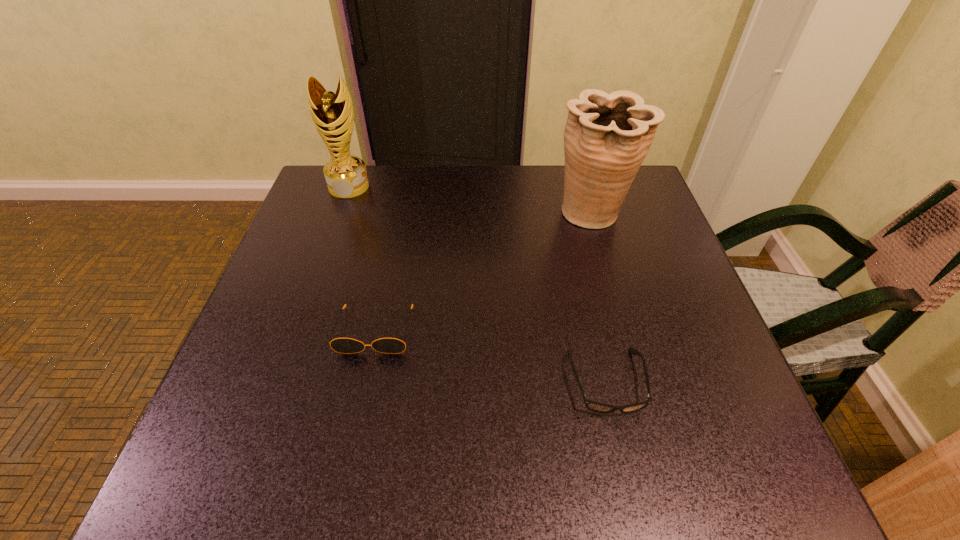
Find the location of a particular element. blank region between the urn and the award is located at coordinates (470, 200).

Identify which object is the second nearest to the urn. Please provide its 2D coordinates. Your answer should be formatted as a tuple, i.e. [(x, y)], where the tuple contains the x and y coordinates of a point satisfying the conditions above.

[(341, 345)]

You are a GUI agent. You are given a task and a screenshot of the screen. Output one action in this format:
    pyautogui.click(x=<x>, y=<y>)
    Task: Click on the object that is the third closest to the spectacles
    
    Given the screenshot: What is the action you would take?
    pyautogui.click(x=332, y=113)

Find the location of a particular element. blank space that satisfies the following two spatial constraints: 1. on the front-facing side of the leftmost object; 2. on the right side of the urn is located at coordinates (340, 213).

Image resolution: width=960 pixels, height=540 pixels. I want to click on vacant region that satisfies the following two spatial constraints: 1. on the front-facing side of the award; 2. on the left side of the urn, so click(340, 213).